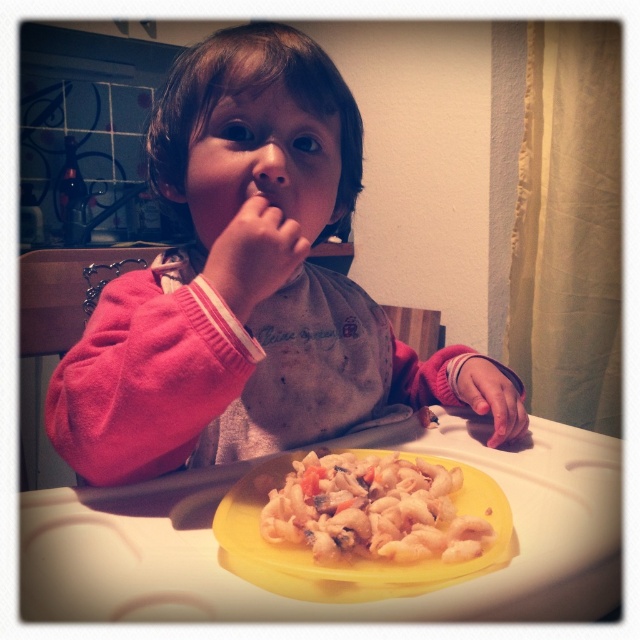
Question: In this image, where is white matte pasta at center located relative to pink fabric hand at center?

Choices:
 (A) left
 (B) right

Answer: (B)

Question: Which object is farther from the camera taking this photo?

Choices:
 (A) pink fleece sleeve at lower right
 (B) white matte pasta at center
 (C) yellow plastic tray at center
 (D) pink fleece sweater at center

Answer: (A)

Question: Does pink fleece sweater at center have a greater width compared to pink fabric hand at center?

Choices:
 (A) no
 (B) yes

Answer: (B)

Question: Among these objects, which one is nearest to the camera?

Choices:
 (A) pink fleece sweater at center
 (B) pink fleece sleeve at lower right

Answer: (A)

Question: Is white matte pasta at center thinner than pink fabric hand at center?

Choices:
 (A) yes
 (B) no

Answer: (B)

Question: Which object is the closest to the white matte pasta at center?

Choices:
 (A) pink fleece sweater at center
 (B) pink fabric hand at center

Answer: (B)